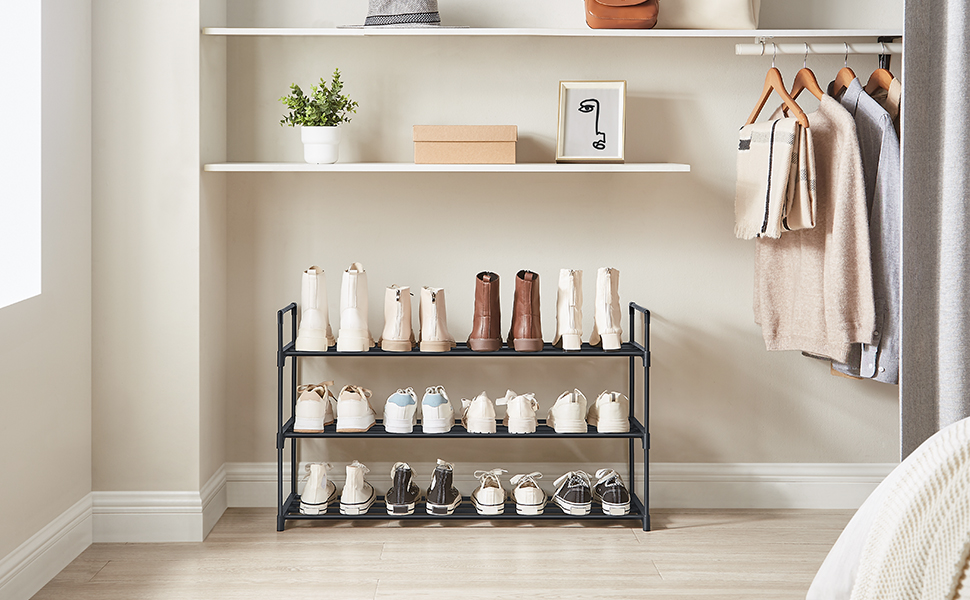
Locate an element on the screen. The height and width of the screenshot is (600, 970). hanging items is located at coordinates (785, 164), (831, 145), (879, 119), (890, 103).